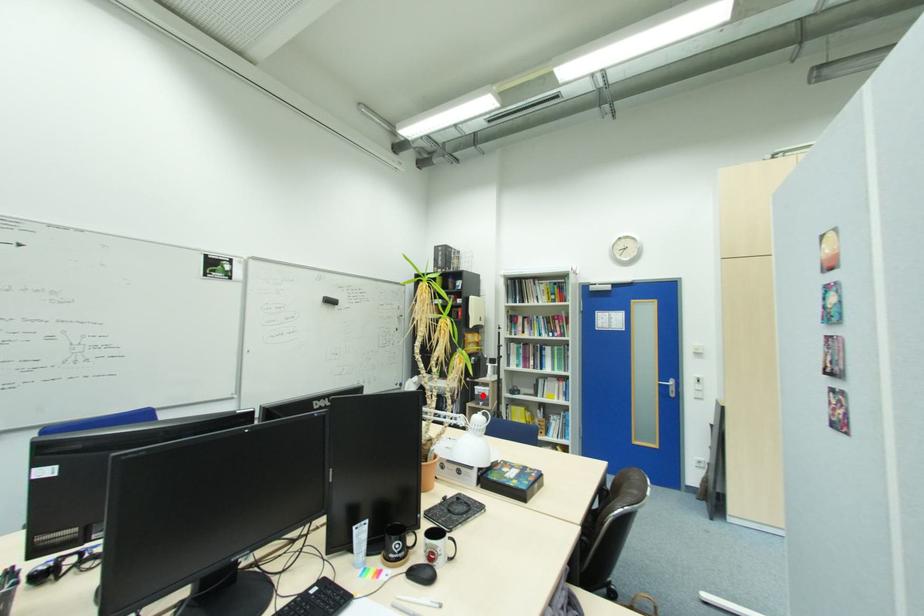
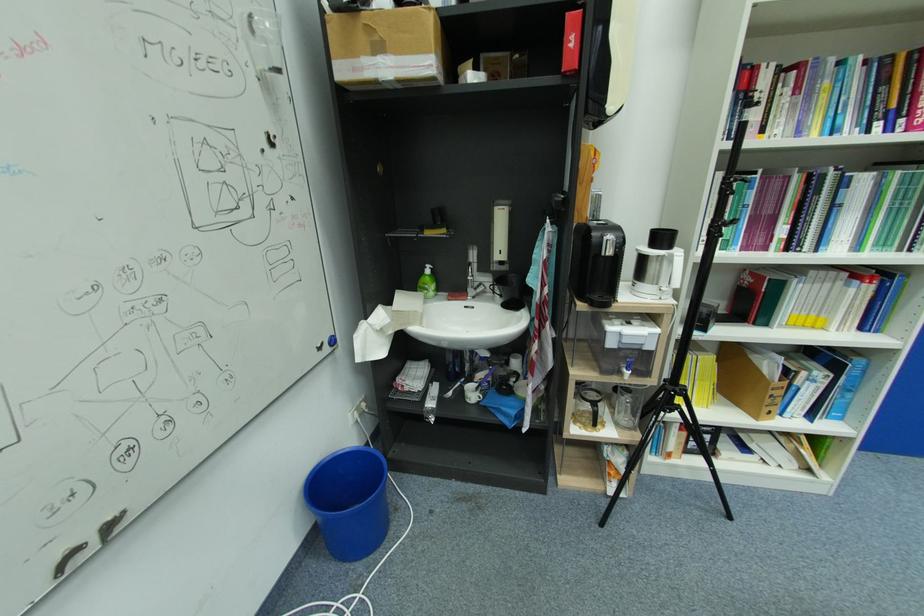
Question: I am providing you with two images of the same scene from different viewpoints. In image1, a red point is highlighted. Considering the same 3D point in image2, which of the following is correct?

Choices:
 (A) It is closer
 (B) It is farther

Answer: (A)